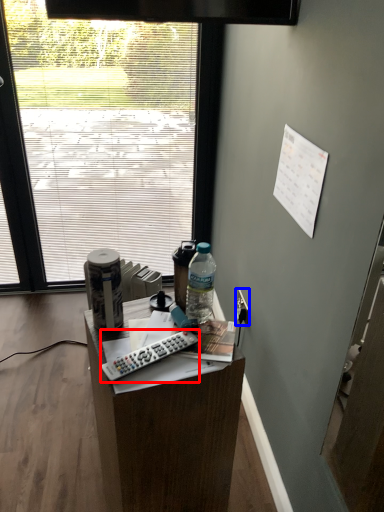
Question: Which point is closer to the camera, remote control (highlighted by a red box) or power outlet (highlighted by a blue box)?

Choices:
 (A) remote control
 (B) power outlet

Answer: (A)